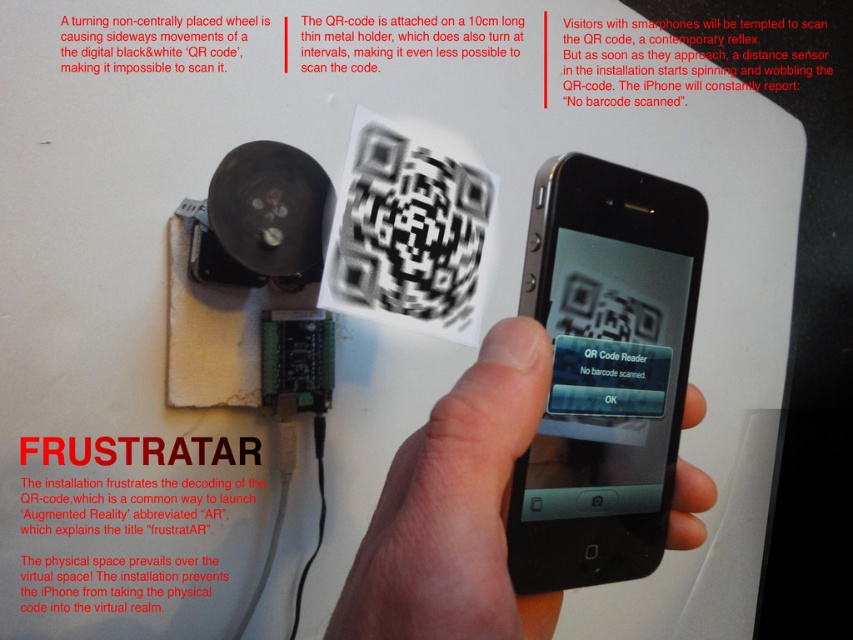
Can you confirm if black matte smartphone at center is wider than skinsmoothhand at center?

In fact, black matte smartphone at center might be narrower than skinsmoothhand at center.

Is point (686, 189) positioned before point (485, 541)?

No, it is behind (485, 541).

I want to click on black matte smartphone at center, so click(604, 371).

The height and width of the screenshot is (640, 853). I want to click on black matte smartphone at center, so click(x=604, y=371).